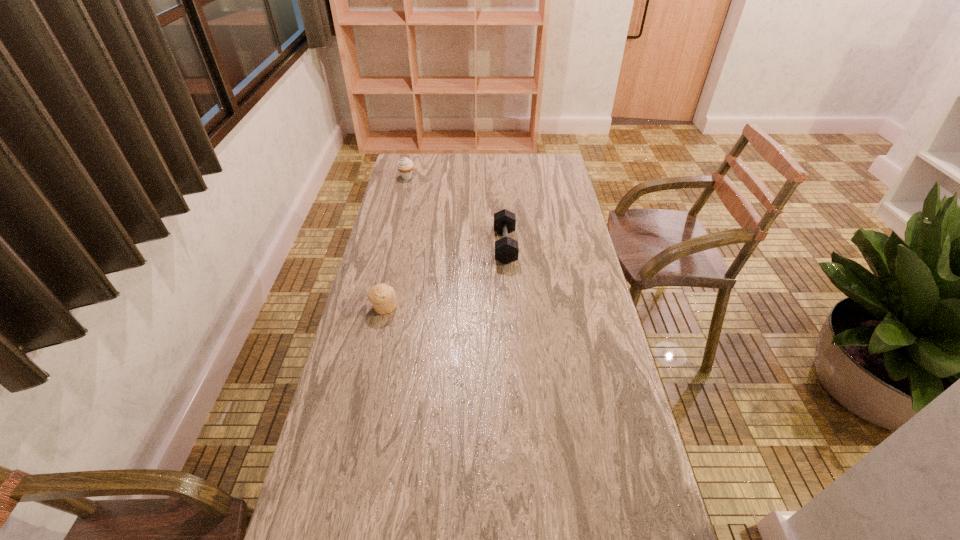
Point out which object is positioned as the second nearest to the shorter muffin. Please provide its 2D coordinates. Your answer should be formatted as a tuple, i.e. [(x, y)], where the tuple contains the x and y coordinates of a point satisfying the conditions above.

[(405, 166)]

Find the location of a particular element. This screenshot has width=960, height=540. object that is the closest to the rightmost object is located at coordinates (383, 297).